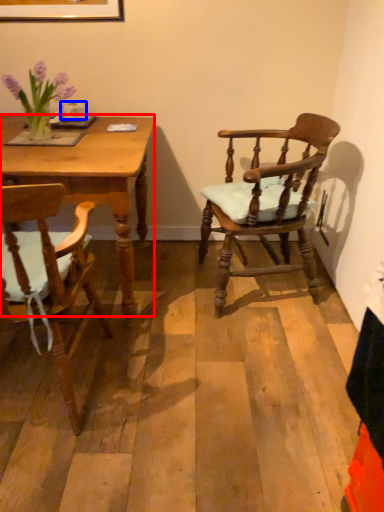
Question: Which point is closer to the camera, desk (highlighted by a red box) or coffee cup (highlighted by a blue box)?

Choices:
 (A) desk
 (B) coffee cup

Answer: (A)